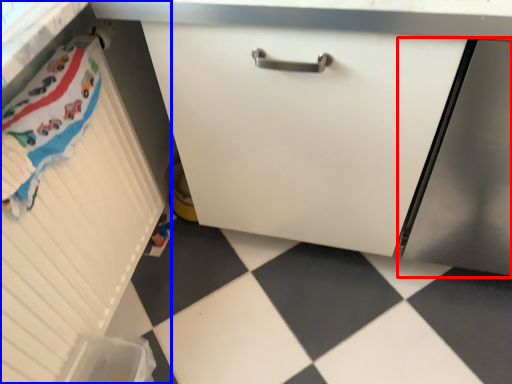
Question: Which object appears closest to the camera in this image, screen door (highlighted by a red box) or cabinetry (highlighted by a blue box)?

Choices:
 (A) screen door
 (B) cabinetry

Answer: (B)